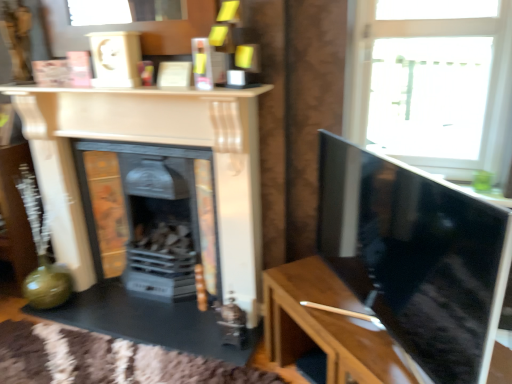
Where is `free spot below black glossy tv at right (from a real-world perspective)`? The width and height of the screenshot is (512, 384). free spot below black glossy tv at right (from a real-world perspective) is located at coordinates (349, 323).